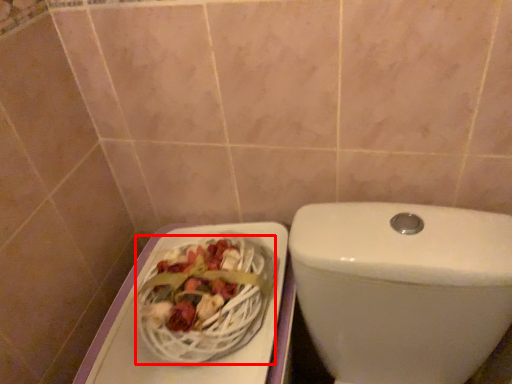
Question: In this image, where is basket (annotated by the red box) located relative to toilet?

Choices:
 (A) left
 (B) right

Answer: (A)